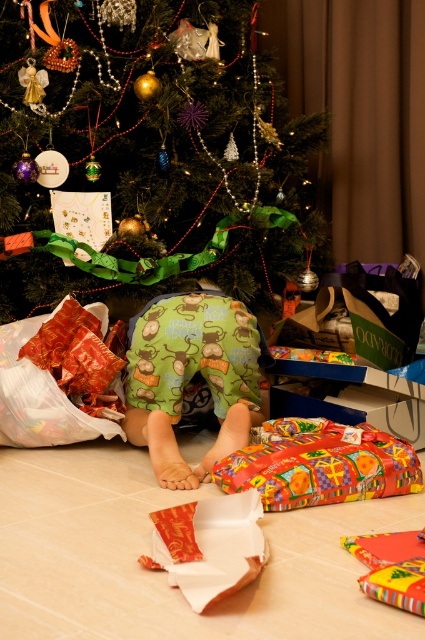
Who is positioned more to the right, green fabric pants at center or multicolored glossy paper at lower center?

multicolored glossy paper at lower center

Is green fabric pants at center bigger than multicolored glossy paper at lower center?

Correct, green fabric pants at center is larger in size than multicolored glossy paper at lower center.

Locate an element on the screen. This screenshot has height=640, width=425. green fabric pants at center is located at coordinates (192, 378).

Who is more forward, (51,205) or (382,449)?

Positioned in front is point (382,449).

From the picture: Can you confirm if shiny metallic ornaments at upper center is smaller than multicolored glossy paper at lower center?

No.

Does point (16, 227) come farther from viewer compared to point (266, 440)?

That is True.

Find the location of a particular element. shiny metallic ornaments at upper center is located at coordinates (155, 150).

Is shiny metallic ornaments at upper center above shiny gold paper at lower center?

Correct, shiny metallic ornaments at upper center is located above shiny gold paper at lower center.

Is shiny metallic ornaments at upper center shorter than shiny gold paper at lower center?

No.

The height and width of the screenshot is (640, 425). What are the coordinates of `shiny metallic ornaments at upper center` in the screenshot? It's located at (155, 150).

The image size is (425, 640). Find the location of `shiny metallic ornaments at upper center`. shiny metallic ornaments at upper center is located at coordinates (155, 150).